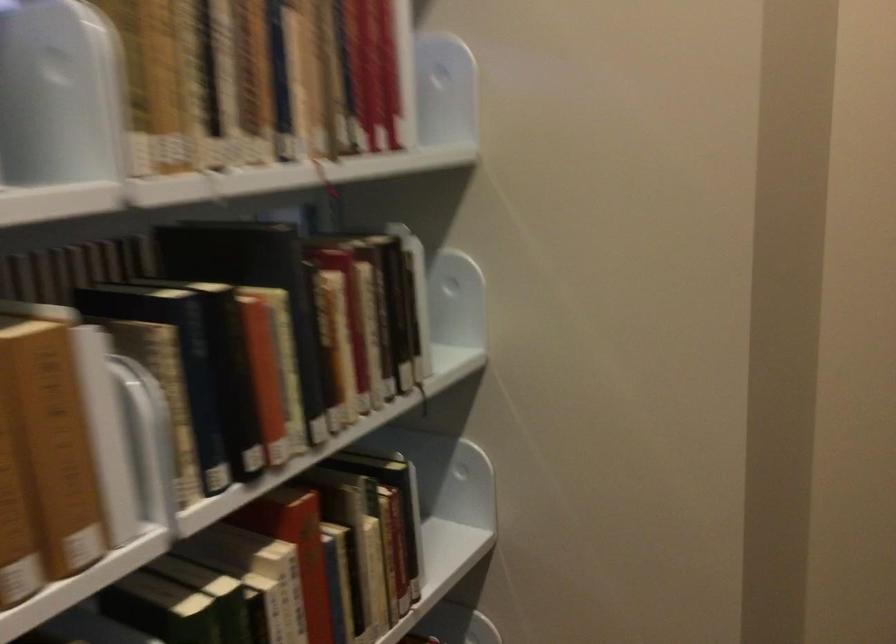
Find the location of a particular element. This screenshot has width=896, height=644. red bookmark string is located at coordinates (323, 178).